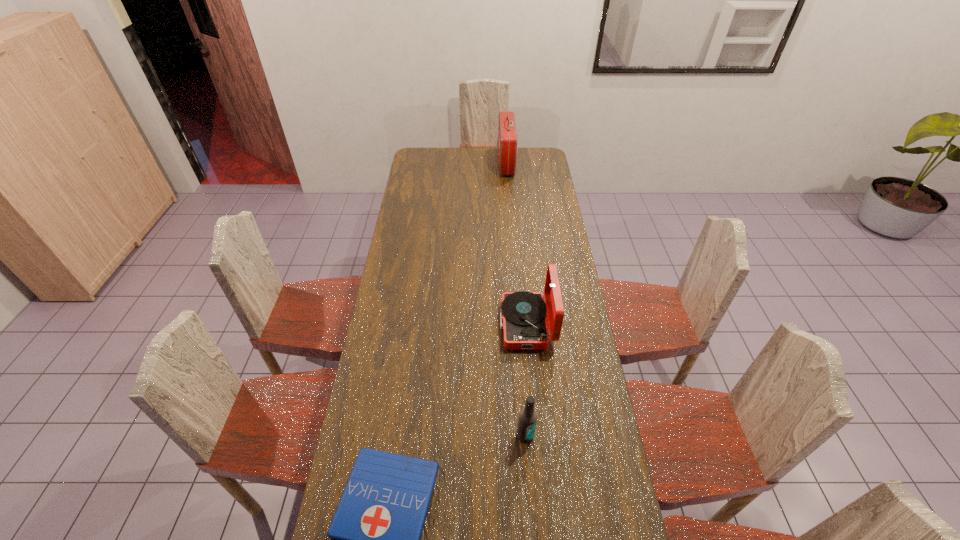
Identify the location of blank area located on the label of the beer bottle. (533, 530).

You are a GUI agent. You are given a task and a screenshot of the screen. Output one action in this format:
    pyautogui.click(x=<x>, y=<y>)
    Task: Click on the object present at the far edge
    
    Given the screenshot: What is the action you would take?
    pyautogui.click(x=507, y=136)

Locate an element on the screen. object that is at the right edge is located at coordinates (525, 327).

Where is `vacant space at the far edge of the desktop`? vacant space at the far edge of the desktop is located at coordinates (482, 158).

You are a GUI agent. You are given a task and a screenshot of the screen. Output one action in this format:
    pyautogui.click(x=<x>, y=<y>)
    Task: Click on the vacant space at the left edge of the desktop
    This screenshot has width=960, height=540.
    Given the screenshot: What is the action you would take?
    pyautogui.click(x=413, y=208)

Find the location of a particular element. The width and height of the screenshot is (960, 540). vacant space at the right edge of the desktop is located at coordinates (537, 170).

This screenshot has width=960, height=540. Identify the location of vacant space at the far left corner of the desktop. (418, 168).

The width and height of the screenshot is (960, 540). Find the location of `empty location between the farther first-aid kit and the third nearest object`. empty location between the farther first-aid kit and the third nearest object is located at coordinates (x=516, y=244).

What are the coordinates of `free space between the second farthest object and the beer bottle` in the screenshot? It's located at coord(526,380).

This screenshot has width=960, height=540. In order to click on free spot between the second nearest object and the third nearest object in this screenshot , I will do `click(526, 380)`.